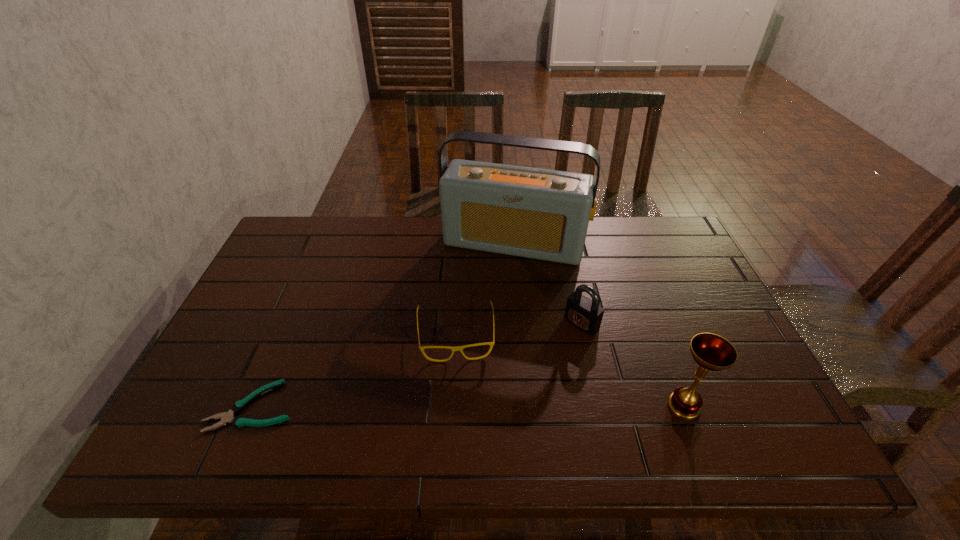
The width and height of the screenshot is (960, 540). What are the coordinates of `pliers that is positioned at the near edge` in the screenshot? It's located at (226, 417).

At what (x,y) coordinates should I click in order to perform the action: click on chalice present at the near edge. Please return your answer as a coordinate pair (x, y). Looking at the image, I should click on (711, 352).

Locate an element on the screen. This screenshot has width=960, height=540. object at the left edge is located at coordinates (226, 417).

This screenshot has width=960, height=540. Identify the location of object that is at the right edge. click(x=711, y=352).

You are a GUI agent. You are given a task and a screenshot of the screen. Output one action in this format:
    pyautogui.click(x=<x>, y=<y>)
    Task: Click on the object situated at the near left corner
    
    Given the screenshot: What is the action you would take?
    pyautogui.click(x=226, y=417)

The height and width of the screenshot is (540, 960). Find the location of `object at the near right corner`. object at the near right corner is located at coordinates (711, 352).

This screenshot has width=960, height=540. In the image, there is a desktop. What are the coordinates of `vacant area at the far edge` in the screenshot? It's located at (432, 227).

Where is `free space at the near edge of the desktop`? free space at the near edge of the desktop is located at coordinates (327, 383).

Locate an element on the screen. vacant space at the left edge of the desktop is located at coordinates (283, 305).

Locate an element on the screen. This screenshot has height=540, width=960. free location at the right edge of the desktop is located at coordinates (681, 273).